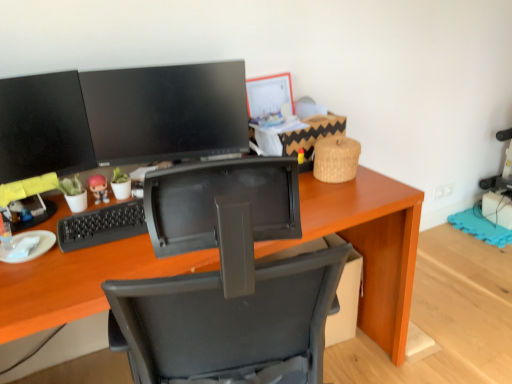
The height and width of the screenshot is (384, 512). What are the coordinates of `wooden desk at center` in the screenshot? It's located at (368, 244).

This screenshot has height=384, width=512. Identify the location of matte black monitor at upper center, positioned as the first computer monitor in right-to-left order. (166, 112).

How much space does matte black monitor at upper center, marked as the second computer monitor in a left-to-right arrangement, occupy vertically?

The height of matte black monitor at upper center, marked as the second computer monitor in a left-to-right arrangement, is 13.42 inches.

The width and height of the screenshot is (512, 384). I want to click on matte plastic figurine at center, so click(98, 188).

Identify the location of wooden desk at center. (368, 244).

Is wooden desk at center wider or thinner than matte plastic figurine at center?

Clearly, wooden desk at center has more width compared to matte plastic figurine at center.

Considering the relative positions of wooden desk at center and matte plastic figurine at center in the image provided, is wooden desk at center to the left or to the right of matte plastic figurine at center?

In the image, wooden desk at center appears on the right side of matte plastic figurine at center.

Is wooden desk at center in front of or behind matte plastic figurine at center in the image?

wooden desk at center is in front of matte plastic figurine at center.

I want to click on toy above the wooden desk at center (from the image's perspective), so [98, 188].

Locate an element on the screen. The height and width of the screenshot is (384, 512). toy to the left of wooden desk at center is located at coordinates (98, 188).

Does matte plastic figurine at center have a lesser height compared to wooden desk at center?

Correct, matte plastic figurine at center is not as tall as wooden desk at center.

Which object is closer to the camera taking this photo, matte plastic figurine at center or wooden desk at center?

wooden desk at center is in front.

Which of these two, matte black monitor at upper center, marked as the second computer monitor in a left-to-right arrangement, or matte plastic figurine at center, is thinner?

Thinner between the two is matte black monitor at upper center, marked as the second computer monitor in a left-to-right arrangement.

Is matte black monitor at upper center, marked as the second computer monitor in a left-to-right arrangement, facing away from matte plastic figurine at center?

That's not correct — matte black monitor at upper center, marked as the second computer monitor in a left-to-right arrangement, is not looking away from matte plastic figurine at center.

Considering the points (238, 132) and (104, 194), which point is behind, point (238, 132) or point (104, 194)?

The point (238, 132) is behind.

Are matte black monitor at upper center, positioned as the first computer monitor in right-to-left order, and matte plastic figurine at center located far from each other?

They are positioned close to each other.

Locate an element on the screen. Image resolution: width=512 pixels, height=384 pixels. computer monitor that is the 1st object located above the wooden desk at center (from the image's perspective) is located at coordinates pos(42,127).

From a real-world perspective, which object rests below the other?

wooden desk at center is physically lower.

Considering the sizes of wooden desk at center and matte black monitor at left, which is the 2th computer monitor from right to left, in the image, is wooden desk at center taller or shorter than matte black monitor at left, which is the 2th computer monitor from right to left,?

In the image, wooden desk at center appears to be taller than matte black monitor at left, which is the 2th computer monitor from right to left.

Between matte black monitor at upper center, marked as the second computer monitor in a left-to-right arrangement, and matte black monitor at left, which appears as the 1th computer monitor when viewed from the left, which one appears on the left side from the viewer's perspective?

matte black monitor at left, which appears as the 1th computer monitor when viewed from the left.

Based on their sizes in the image, would you say matte black monitor at upper center, positioned as the first computer monitor in right-to-left order, is bigger or smaller than matte black monitor at left, which is the 2th computer monitor from right to left?

Clearly, matte black monitor at upper center, positioned as the first computer monitor in right-to-left order, is larger in size than matte black monitor at left, which is the 2th computer monitor from right to left.

Does matte black monitor at upper center, marked as the second computer monitor in a left-to-right arrangement, turn towards matte black monitor at left, which is the 2th computer monitor from right to left?

No, matte black monitor at upper center, marked as the second computer monitor in a left-to-right arrangement, is not aimed at matte black monitor at left, which is the 2th computer monitor from right to left.

Where is `computer monitor above the matte black monitor at left, which appears as the 1th computer monitor when viewed from the left (from the image's perspective)`? The height and width of the screenshot is (384, 512). computer monitor above the matte black monitor at left, which appears as the 1th computer monitor when viewed from the left (from the image's perspective) is located at coordinates (166, 112).

Locate an element on the screen. The image size is (512, 384). desk below the matte black monitor at upper center, positioned as the first computer monitor in right-to-left order (from a real-world perspective) is located at coordinates (368, 244).

From a real-world perspective, is wooden desk at center above or below matte black monitor at upper center, marked as the second computer monitor in a left-to-right arrangement?

wooden desk at center is below matte black monitor at upper center, marked as the second computer monitor in a left-to-right arrangement.

Choose the correct answer: Is wooden desk at center inside matte black monitor at upper center, positioned as the first computer monitor in right-to-left order, or outside it?

wooden desk at center is located beyond the bounds of matte black monitor at upper center, positioned as the first computer monitor in right-to-left order.

Does wooden desk at center lie behind matte black monitor at upper center, positioned as the first computer monitor in right-to-left order?

No, wooden desk at center is closer to the viewer.

Is point (58, 113) closer or farther from the camera than point (274, 246)?

Clearly, point (58, 113) is more distant from the camera than point (274, 246).

In order to click on computer monitor that is the 1st one when counting backward from the wooden desk at center in this screenshot , I will do pos(42,127).

Which object is positioned more to the left, matte black monitor at left, which appears as the 1th computer monitor when viewed from the left, or wooden desk at center?

matte black monitor at left, which appears as the 1th computer monitor when viewed from the left.

Considering their positions, is matte black monitor at left, which appears as the 1th computer monitor when viewed from the left, located in front of or behind wooden desk at center?

Clearly, matte black monitor at left, which appears as the 1th computer monitor when viewed from the left, is behind wooden desk at center.

This screenshot has width=512, height=384. I want to click on desk lying in front of the matte plastic figurine at center, so click(368, 244).

Identify the location of desk below the matte plastic figurine at center (from the image's perspective). (368, 244).

Looking at this image, looking at the image, which one is located closer to matte black monitor at upper center, positioned as the first computer monitor in right-to-left order, matte black monitor at left, which is the 2th computer monitor from right to left, or wooden desk at center?

matte black monitor at left, which is the 2th computer monitor from right to left, is positioned closer to the anchor matte black monitor at upper center, positioned as the first computer monitor in right-to-left order.

Looking at the image, which one is located further to wooden desk at center, matte plastic figurine at center or matte black monitor at upper center, marked as the second computer monitor in a left-to-right arrangement?

The object further to wooden desk at center is matte plastic figurine at center.

From the picture: From the image, which object appears to be nearer to matte black monitor at left, which appears as the 1th computer monitor when viewed from the left, matte plastic figurine at center or matte black monitor at upper center, marked as the second computer monitor in a left-to-right arrangement?

matte black monitor at upper center, marked as the second computer monitor in a left-to-right arrangement, lies closer to matte black monitor at left, which appears as the 1th computer monitor when viewed from the left, than the other object.

Consider the image. Considering their positions, is matte black monitor at upper center, positioned as the first computer monitor in right-to-left order, positioned further to wooden desk at center than matte black monitor at left, which is the 2th computer monitor from right to left?

Based on the image, matte black monitor at left, which is the 2th computer monitor from right to left, appears to be further to wooden desk at center.

Considering their positions, is matte black monitor at upper center, marked as the second computer monitor in a left-to-right arrangement, positioned closer to matte plastic figurine at center than matte black monitor at left, which appears as the 1th computer monitor when viewed from the left?

Based on the image, matte black monitor at left, which appears as the 1th computer monitor when viewed from the left, appears to be nearer to matte plastic figurine at center.

Estimate the real-world distances between objects in this image. Which object is closer to wooden desk at center, matte black monitor at upper center, marked as the second computer monitor in a left-to-right arrangement, or matte plastic figurine at center?

matte black monitor at upper center, marked as the second computer monitor in a left-to-right arrangement, is closer to wooden desk at center.

Which object lies nearer to the anchor point wooden desk at center, matte plastic figurine at center or matte black monitor at left, which appears as the 1th computer monitor when viewed from the left?

matte black monitor at left, which appears as the 1th computer monitor when viewed from the left.

Looking at the image, which one is located further to matte black monitor at left, which is the 2th computer monitor from right to left, matte black monitor at upper center, positioned as the first computer monitor in right-to-left order, or wooden desk at center?

Among the two, wooden desk at center is located further to matte black monitor at left, which is the 2th computer monitor from right to left.

Locate an element on the screen. The image size is (512, 384). toy between matte black monitor at upper center, marked as the second computer monitor in a left-to-right arrangement, and wooden desk at center vertically is located at coordinates pyautogui.click(x=98, y=188).

Where is `computer monitor between matte black monitor at upper center, positioned as the first computer monitor in right-to-left order, and wooden desk at center from top to bottom`? This screenshot has width=512, height=384. computer monitor between matte black monitor at upper center, positioned as the first computer monitor in right-to-left order, and wooden desk at center from top to bottom is located at coordinates (42, 127).

This screenshot has width=512, height=384. I want to click on toy between matte black monitor at left, which is the 2th computer monitor from right to left, and matte black monitor at upper center, positioned as the first computer monitor in right-to-left order, so click(x=98, y=188).